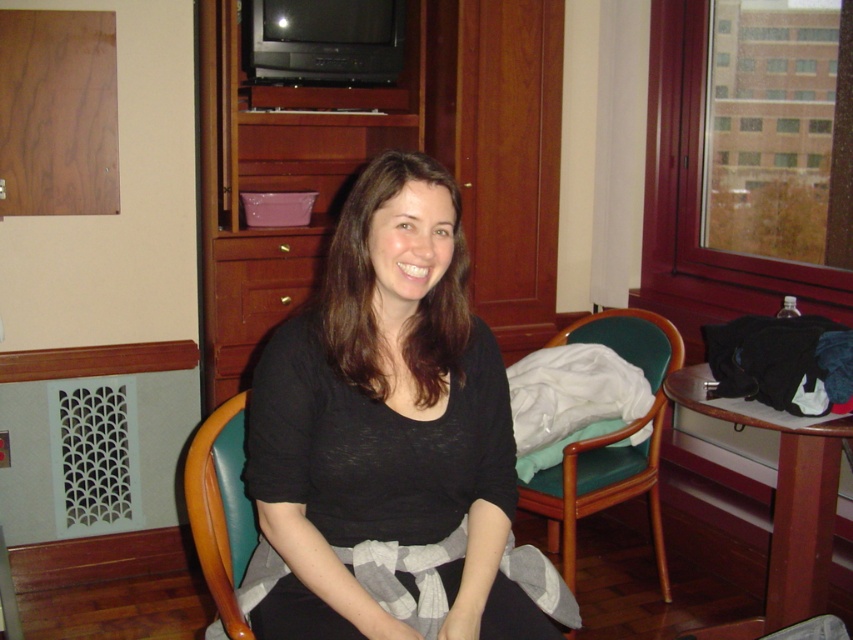
Question: Does black matte shirt at center appear under green leather chair at lower left?

Choices:
 (A) yes
 (B) no

Answer: (B)

Question: Is black matte shirt at center further to the viewer compared to teal leather chair at center?

Choices:
 (A) no
 (B) yes

Answer: (A)

Question: Which point is closer to the camera taking this photo?

Choices:
 (A) (639, 362)
 (B) (299, 280)

Answer: (A)

Question: Does teal leather chair at center appear on the left side of green leather chair at lower left?

Choices:
 (A) yes
 (B) no

Answer: (B)

Question: Which point appears farthest from the camera in this image?

Choices:
 (A) (598, 330)
 (B) (206, 490)
 (C) (252, 148)

Answer: (C)

Question: Among these points, which one is nearest to the camera?

Choices:
 (A) (573, 458)
 (B) (231, 298)
 (C) (506, 212)
 (D) (370, 520)

Answer: (D)